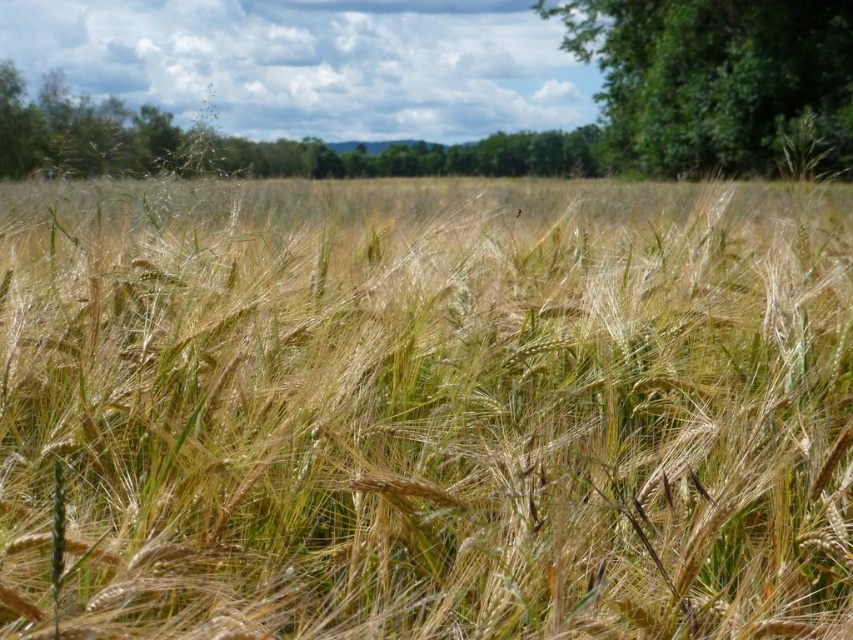
Can you confirm if golden wheat field at center is positioned to the right of green leafy tree at upper right?

No, golden wheat field at center is not to the right of green leafy tree at upper right.

You are a GUI agent. You are given a task and a screenshot of the screen. Output one action in this format:
    pyautogui.click(x=<x>, y=<y>)
    Task: Click on the golden wheat field at center
    This screenshot has height=640, width=853.
    Given the screenshot: What is the action you would take?
    pyautogui.click(x=425, y=408)

Is point (456, 260) farther from camera compared to point (730, 68)?

No, it is in front of (730, 68).

Locate an element on the screen. The width and height of the screenshot is (853, 640). golden wheat field at center is located at coordinates pos(425,408).